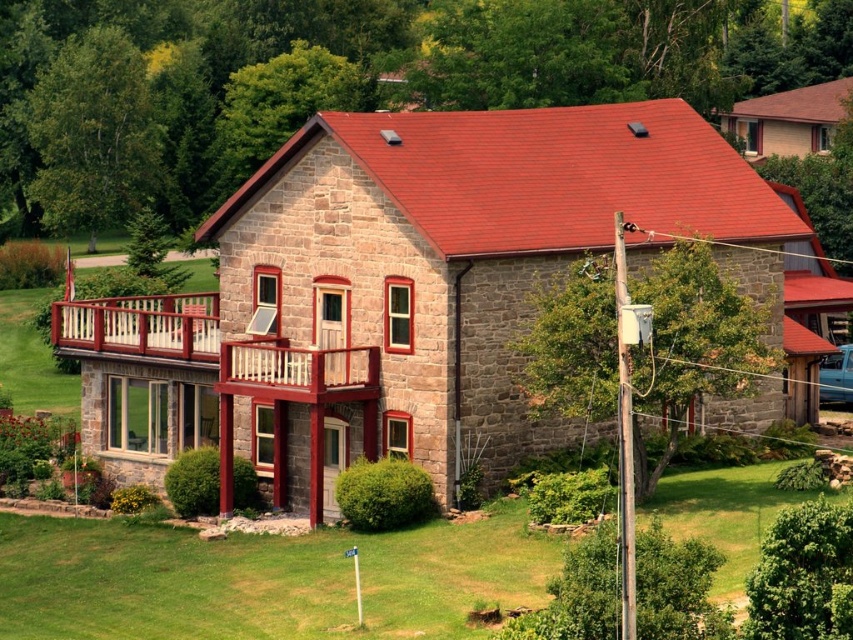
Question: Which of the following is the farthest from the observer?

Choices:
 (A) wooden railing at upper left
 (B) wooden railing balcony at center

Answer: (A)

Question: From the image, what is the correct spatial relationship of wooden railing at upper left in relation to wooden railing balcony at center?

Choices:
 (A) left
 (B) right

Answer: (A)

Question: Among these objects, which one is nearest to the camera?

Choices:
 (A) wooden railing at upper left
 (B) wooden railing balcony at center

Answer: (B)

Question: Is wooden railing at upper left to the left of wooden railing balcony at center from the viewer's perspective?

Choices:
 (A) yes
 (B) no

Answer: (A)

Question: Is wooden railing at upper left further to the viewer compared to wooden railing balcony at center?

Choices:
 (A) no
 (B) yes

Answer: (B)